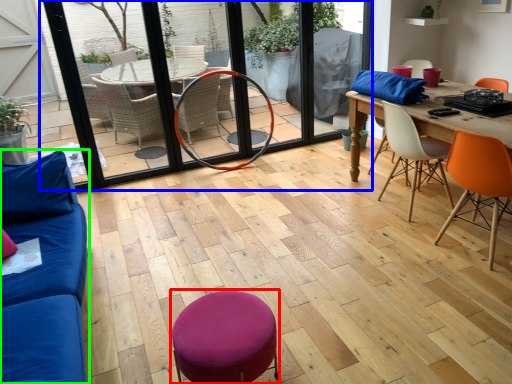
Question: Which object is the farthest from bar stool (highlighted by a red box)? Choose among these: screen door (highlighted by a blue box) or studio couch (highlighted by a green box).

Choices:
 (A) screen door
 (B) studio couch

Answer: (A)